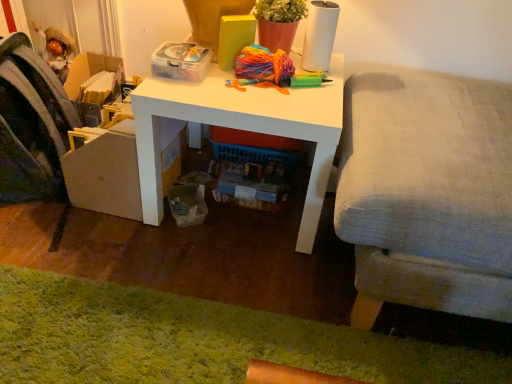
Question: From the image's perspective, is green shaggy rug at lower left over white matte desk at center?

Choices:
 (A) no
 (B) yes

Answer: (A)

Question: Would you say green shaggy rug at lower left contains white matte desk at center?

Choices:
 (A) yes
 (B) no

Answer: (B)

Question: From the image's perspective, is green shaggy rug at lower left located beneath white matte desk at center?

Choices:
 (A) no
 (B) yes

Answer: (B)

Question: Is green shaggy rug at lower left not within white matte desk at center?

Choices:
 (A) no
 (B) yes

Answer: (B)

Question: Does green shaggy rug at lower left come behind white matte desk at center?

Choices:
 (A) no
 (B) yes

Answer: (A)

Question: From the image's perspective, is transparent plastic storage box at upper center located above or below light gray fabric couch at right?

Choices:
 (A) above
 (B) below

Answer: (A)

Question: In terms of height, does transparent plastic storage box at upper center look taller or shorter compared to light gray fabric couch at right?

Choices:
 (A) tall
 (B) short

Answer: (B)

Question: Looking at their shapes, would you say transparent plastic storage box at upper center is wider or thinner than light gray fabric couch at right?

Choices:
 (A) wide
 (B) thin

Answer: (B)

Question: Considering the relative positions of transparent plastic storage box at upper center and light gray fabric couch at right in the image provided, is transparent plastic storage box at upper center to the left or to the right of light gray fabric couch at right?

Choices:
 (A) left
 (B) right

Answer: (A)

Question: Is velvet fabric swivel chair at left bigger or smaller than transparent plastic storage box at upper center?

Choices:
 (A) big
 (B) small

Answer: (A)

Question: In the image, is velvet fabric swivel chair at left on the left side or the right side of transparent plastic storage box at upper center?

Choices:
 (A) left
 (B) right

Answer: (A)

Question: Considering the positions of point (24, 49) and point (193, 64), is point (24, 49) closer or farther from the camera than point (193, 64)?

Choices:
 (A) closer
 (B) farther

Answer: (B)

Question: Looking at their shapes, would you say velvet fabric swivel chair at left is wider or thinner than transparent plastic storage box at upper center?

Choices:
 (A) wide
 (B) thin

Answer: (A)

Question: Considering their positions, is light gray fabric couch at right located in front of or behind transparent plastic storage box at upper center?

Choices:
 (A) front
 (B) behind

Answer: (A)

Question: From a real-world perspective, relative to transparent plastic storage box at upper center, is light gray fabric couch at right vertically above or below?

Choices:
 (A) above
 (B) below

Answer: (B)